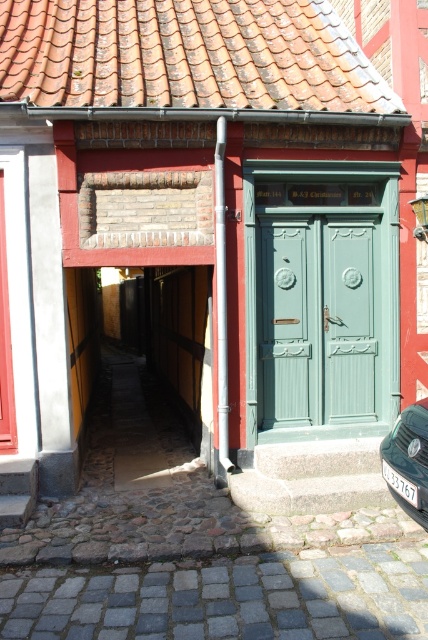
Question: In this image, where is terracotta clay tiles at upper center located relative to green matte door at center?

Choices:
 (A) above
 (B) below

Answer: (A)

Question: Which is farther from the green matte door at center?

Choices:
 (A) terracotta clay tiles at upper center
 (B) green wooden door at center
 (C) metallic silver car at lower right

Answer: (A)

Question: Is terracotta clay tiles at upper center smaller than green matte door at center?

Choices:
 (A) no
 (B) yes

Answer: (A)

Question: Can you confirm if green matte door at center is smaller than metallic silver car at lower right?

Choices:
 (A) yes
 (B) no

Answer: (A)

Question: Which object is positioned farthest from the terracotta clay tiles at upper center?

Choices:
 (A) green matte door at center
 (B) green wooden door at center
 (C) metallic silver car at lower right

Answer: (C)

Question: Which object appears farthest from the camera in this image?

Choices:
 (A) metallic silver car at lower right
 (B) terracotta clay tiles at upper center
 (C) green matte door at center
 (D) green wooden door at center

Answer: (C)